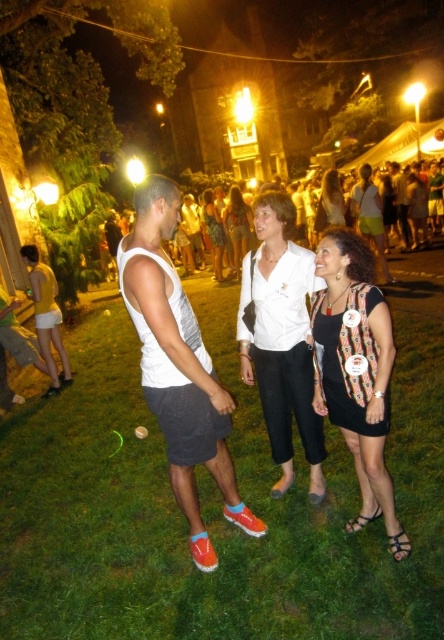
Question: Which point is farther from the camera taking this photo?

Choices:
 (A) (321, 212)
 (B) (210, 241)

Answer: (B)

Question: Where is matte black dress at center located in relation to white shirt at center in the image?

Choices:
 (A) left
 (B) right

Answer: (B)

Question: Which of the following is the farthest from the observer?

Choices:
 (A) matte yellow tank top at left
 (B) white smooth shirt at center
 (C) black textured dress at center

Answer: (A)

Question: Is green grass at center bigger than matte yellow tank top at left?

Choices:
 (A) no
 (B) yes

Answer: (A)

Question: Which of the following is the closest to the observer?

Choices:
 (A) black textured dress at center
 (B) green grass at center
 (C) white smooth shirt at center

Answer: (B)

Question: Can you confirm if green grass at center is positioned to the left of white matte shirt at center?

Choices:
 (A) no
 (B) yes

Answer: (A)